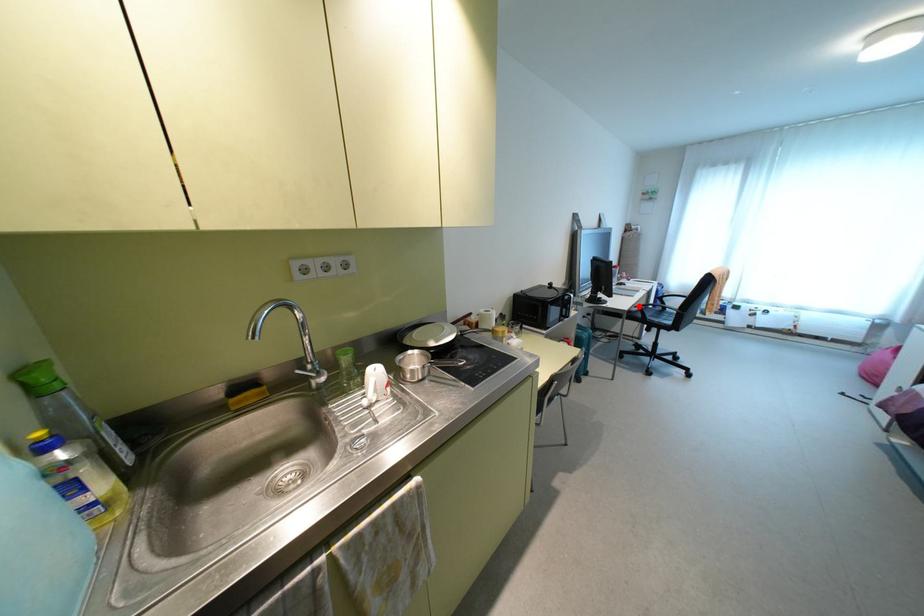
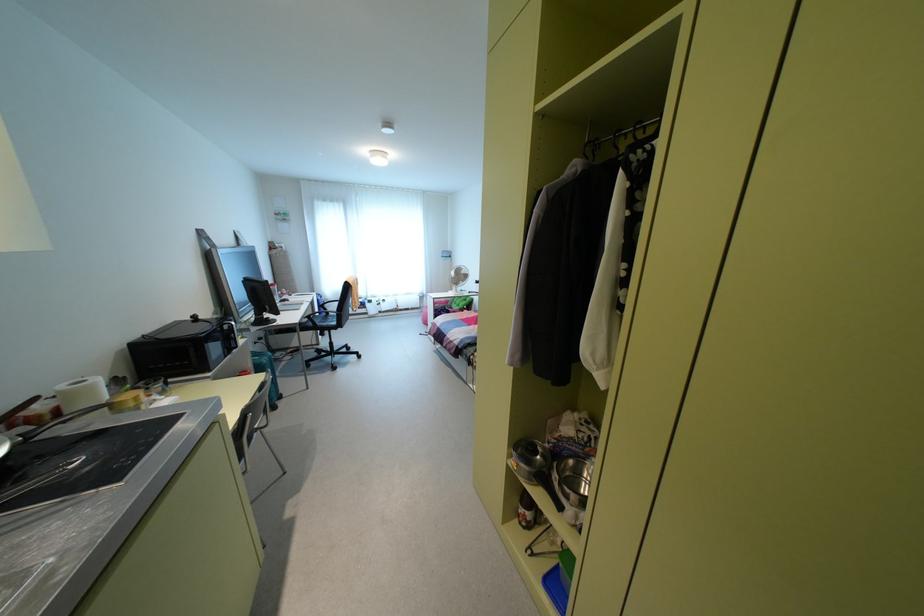
Question: I am providing you with two images of the same scene from different viewpoints. Given a red point in image1, look at the same physical point in image2. Is it:

Choices:
 (A) Closer to the viewpoint
 (B) Farther from the viewpoint

Answer: (A)